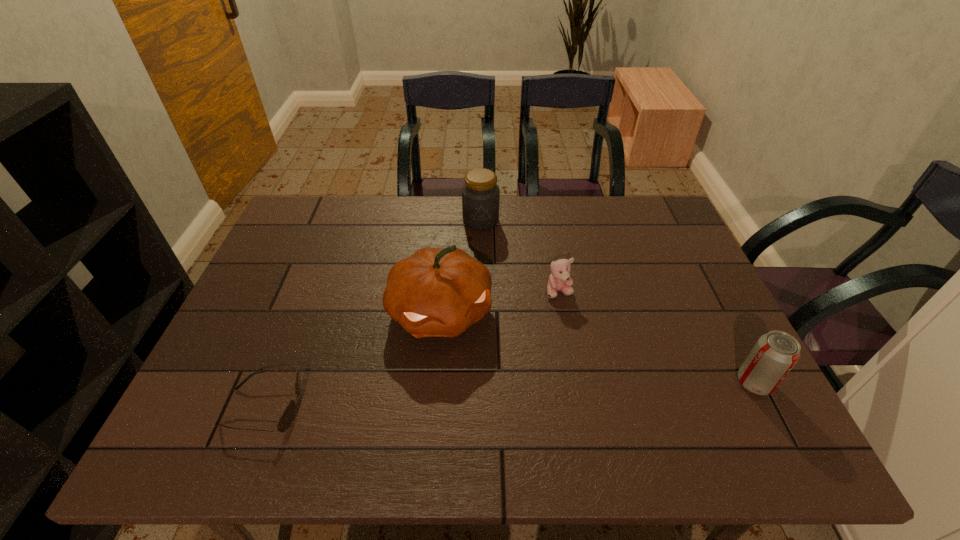
I want to click on free space at the far left corner, so click(324, 227).

Identify the location of free space at the near left corner. (247, 394).

Where is `unoccupied area between the pumpkin and the fourth tallest object`? The width and height of the screenshot is (960, 540). unoccupied area between the pumpkin and the fourth tallest object is located at coordinates (500, 302).

Locate an element on the screen. Image resolution: width=960 pixels, height=540 pixels. free space between the tallest object and the second shortest object is located at coordinates (500, 302).

The image size is (960, 540). Find the location of `empty space between the farthest object and the third tallest object`. empty space between the farthest object and the third tallest object is located at coordinates (617, 301).

Identify the location of vacant space that is in between the second object from right to left and the shortest object. (412, 349).

What are the coordinates of `vacant space that's between the fourth tallest object and the pumpkin` in the screenshot? It's located at (500, 302).

What are the coordinates of `vacant space that's between the second object from right to left and the soda can` in the screenshot? It's located at (657, 337).

Identify the location of the closest object relative to the rightmost object. This screenshot has height=540, width=960. [559, 280].

Locate an element on the screen. The width and height of the screenshot is (960, 540). object that is the closest one to the farthest object is located at coordinates [x=436, y=292].